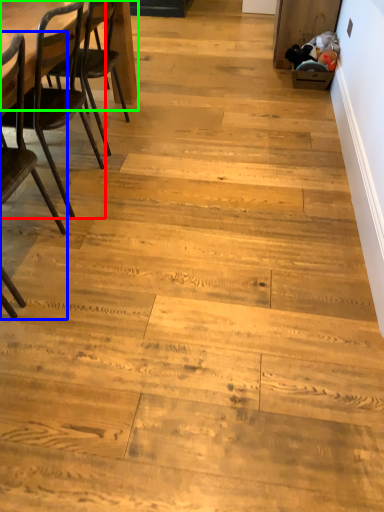
Question: Based on their relative distances, which object is farther from chair (highlighted by a red box)? Choose from chair (highlighted by a blue box) and table (highlighted by a green box).

Choices:
 (A) chair
 (B) table

Answer: (B)